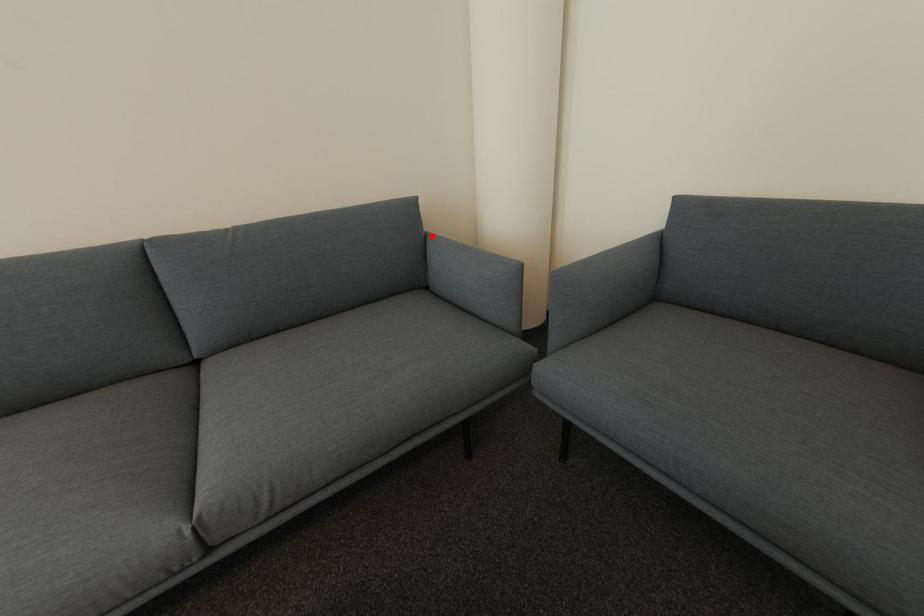
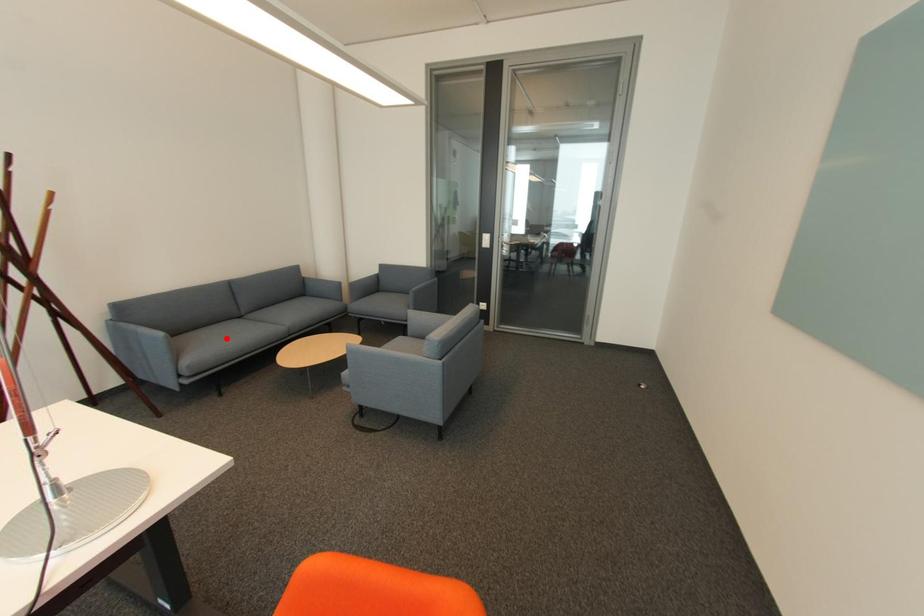
I am providing you with two images of the same scene from different viewpoints. A red point is marked on the first image and another point is marked on the second image. Is the marked point in image1 the same physical position as the marked point in image2?

No